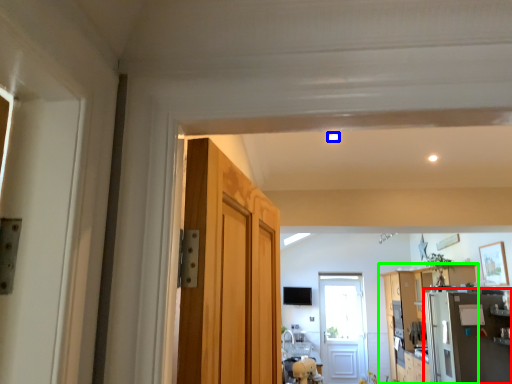
Question: Which is nearer to the appliance (highlighted by a red box)? light (highlighted by a blue box) or cabinetry (highlighted by a green box).

Choices:
 (A) light
 (B) cabinetry

Answer: (B)